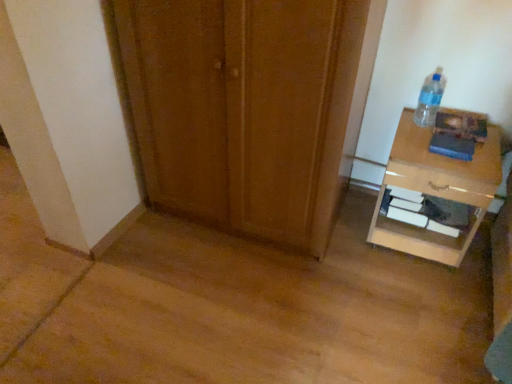
This screenshot has height=384, width=512. Identify the location of vacant space situated on the left part of light brown glossy nightstand at right. (348, 246).